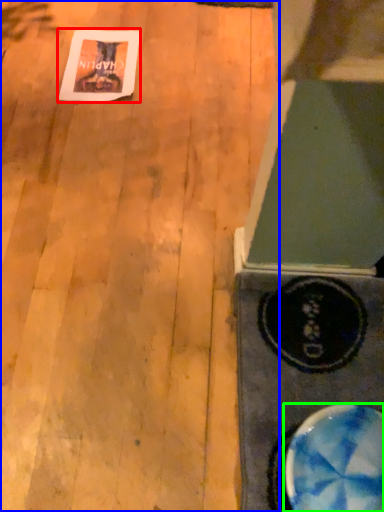
Question: Which object is the farthest from postcard (highlighted by a red box)? Choose among these: plywood (highlighted by a blue box) or bowl (highlighted by a green box).

Choices:
 (A) plywood
 (B) bowl

Answer: (B)